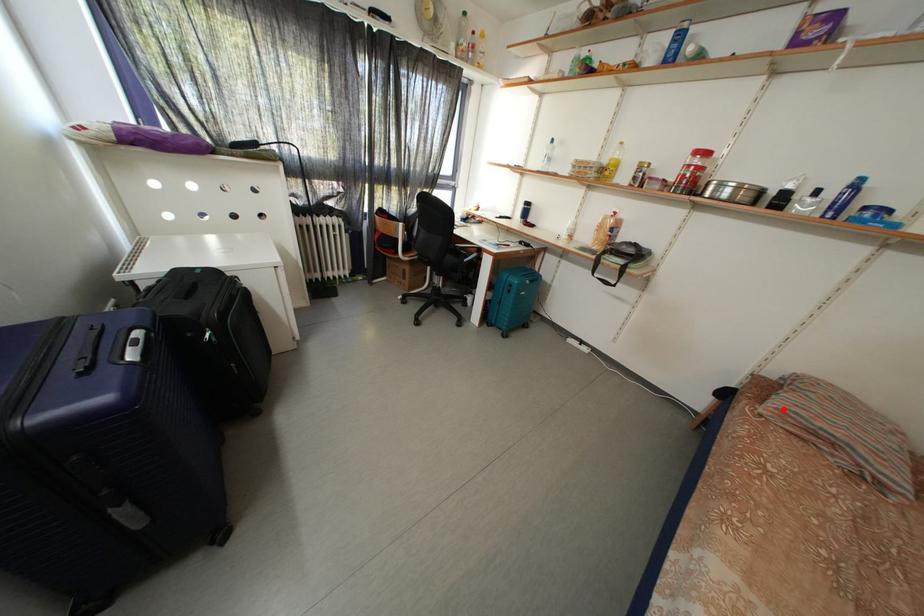
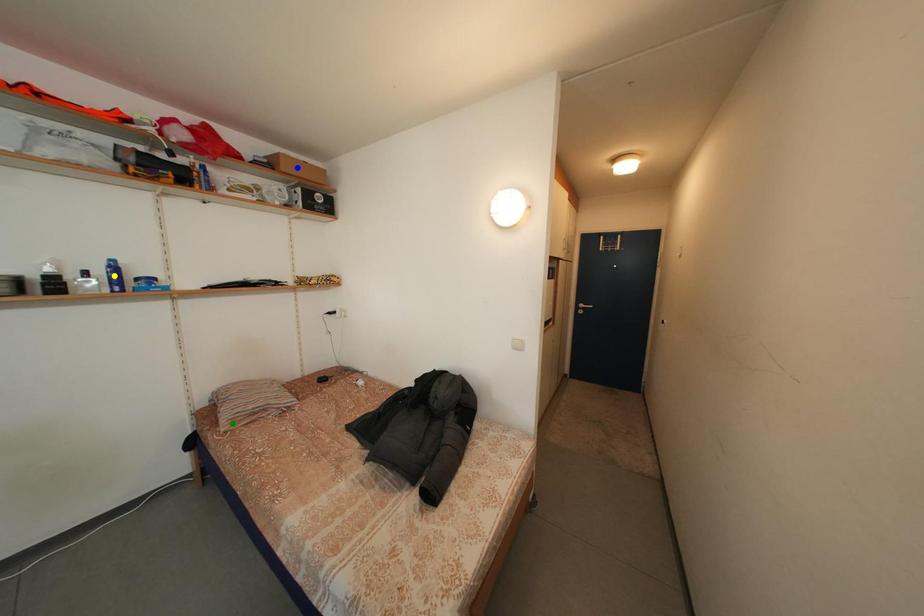
Question: I am providing you with two images of the same scene from different viewpoints. A red point is marked on the first image. You are given multiple points on the second image. Which spot in image 2 lines up with the point in image 1?

Choices:
 (A) yellow point
 (B) blue point
 (C) green point

Answer: (C)